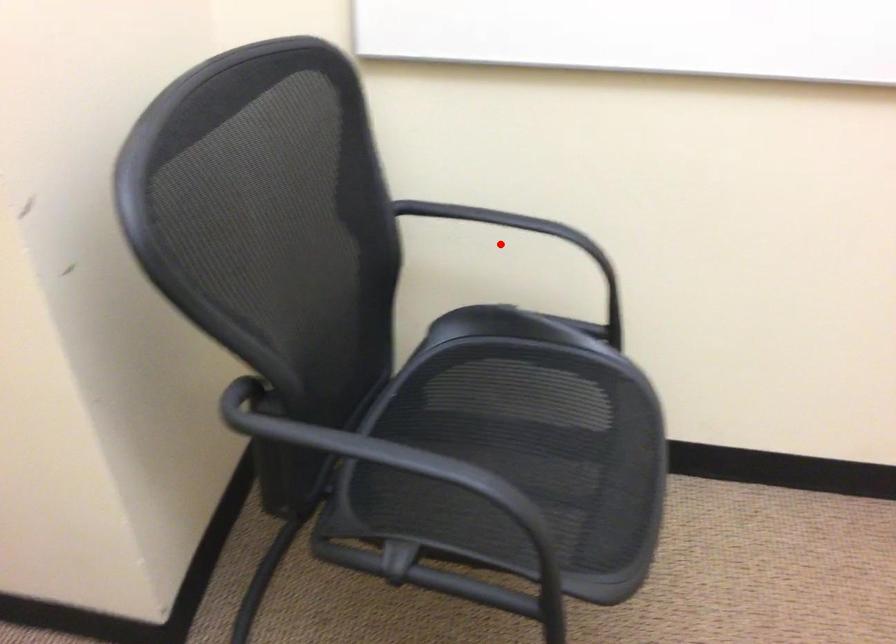
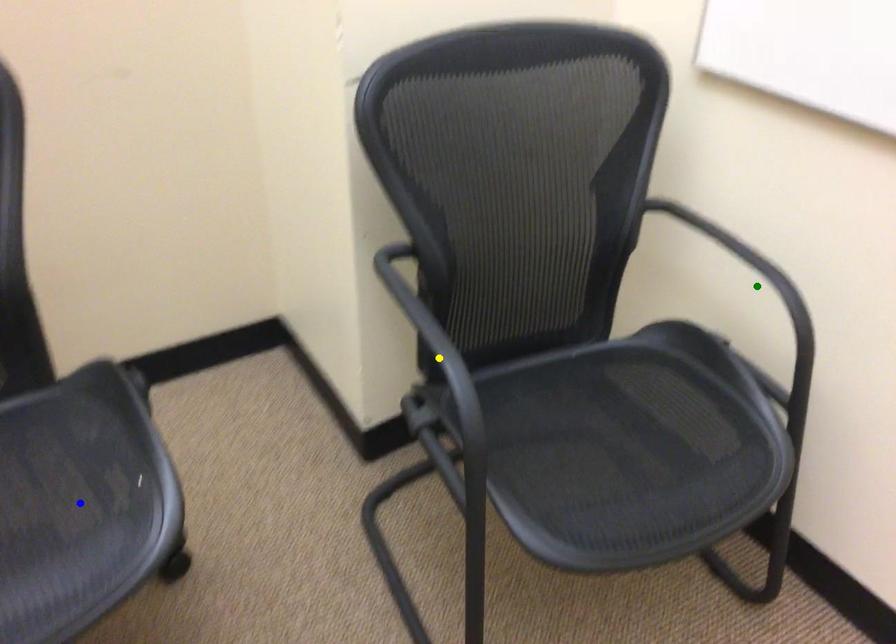
Question: I am providing you with two images of the same scene from different viewpoints. A red point is marked on the first image. You are given multiple points on the second image. Which point in image 2 is actually the same real-world point as the red point in image 1?

Choices:
 (A) blue point
 (B) yellow point
 (C) green point

Answer: (C)